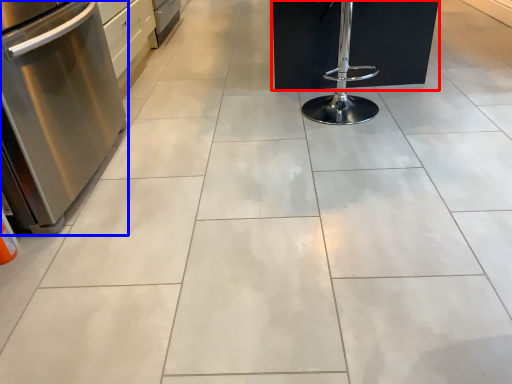
Question: Which object appears farthest to the camera in this image, furniture (highlighted by a red box) or kitchen appliance (highlighted by a blue box)?

Choices:
 (A) furniture
 (B) kitchen appliance

Answer: (A)